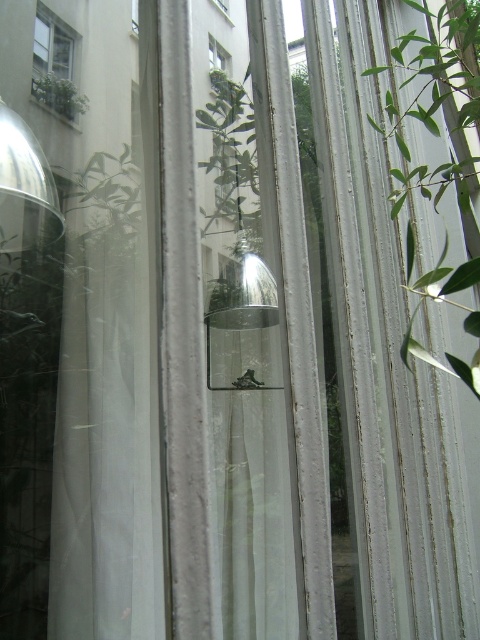
Between green leafy plant at center and transparent glass frog at center, which one is positioned higher?

transparent glass frog at center is higher up.

Is point (228, 189) in front of point (132, 17)?

That is False.

The height and width of the screenshot is (640, 480). In order to click on green leafy plant at center in this screenshot , I will do `click(228, 147)`.

You are a GUI agent. You are given a task and a screenshot of the screen. Output one action in this format:
    pyautogui.click(x=<x>, y=<y>)
    Task: Click on the green leafy plant at center
    The width and height of the screenshot is (480, 640).
    Given the screenshot: What is the action you would take?
    pyautogui.click(x=228, y=147)

Is point (450, 65) positioned behind point (66, 115)?

That is True.

Can you confirm if green leafy plant at right is positioned to the right of green leafy plant at upper left?

Correct, you'll find green leafy plant at right to the right of green leafy plant at upper left.

Which is behind, point (420, 6) or point (57, 104)?

Point (420, 6)

Identify the location of green leafy plant at right. (433, 72).

Between green matte window at upper left and transparent glass window at center, which one is positioned lower?

green matte window at upper left is below.

Is point (60, 56) farther from viewer compared to point (219, 1)?

That is False.

You are a GUI agent. You are given a task and a screenshot of the screen. Output one action in this format:
    pyautogui.click(x=<x>, y=<y>)
    Task: Click on the green matte window at upper left
    This screenshot has height=640, width=480.
    Given the screenshot: What is the action you would take?
    pyautogui.click(x=55, y=68)